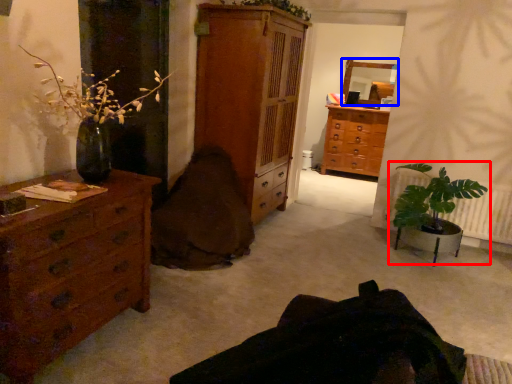
Question: Which point is closer to the camera, houseplant (highlighted by a red box) or mirror (highlighted by a blue box)?

Choices:
 (A) houseplant
 (B) mirror

Answer: (A)